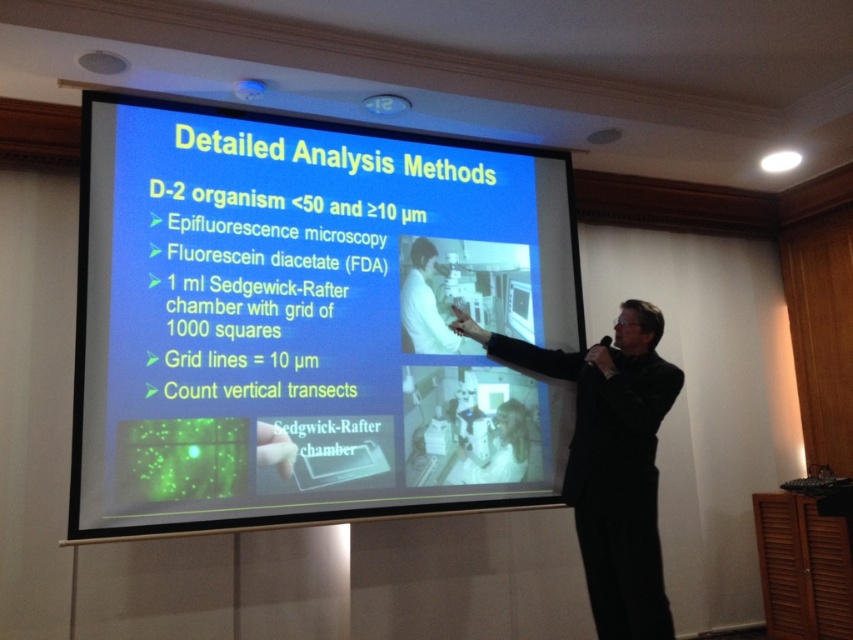
Question: Which of these objects is positioned farthest from the white lab coat at center?

Choices:
 (A) black suit at center
 (B) blue matte projector screen at center

Answer: (A)

Question: From the image, what is the correct spatial relationship of blue matte projector screen at center in relation to white lab coat at center?

Choices:
 (A) above
 (B) below

Answer: (B)

Question: Which point is farther from the camera taking this photo?

Choices:
 (A) (633, 330)
 (B) (532, 266)
 (C) (410, 266)

Answer: (B)

Question: Can you confirm if blue matte projector screen at center is positioned to the left of black suit at center?

Choices:
 (A) yes
 (B) no

Answer: (A)

Question: Considering the relative positions of blue matte projector screen at center and black suit at center in the image provided, where is blue matte projector screen at center located with respect to black suit at center?

Choices:
 (A) left
 (B) right

Answer: (A)

Question: Which object is closer to the camera taking this photo?

Choices:
 (A) blue matte projector screen at center
 (B) white lab coat at center

Answer: (A)